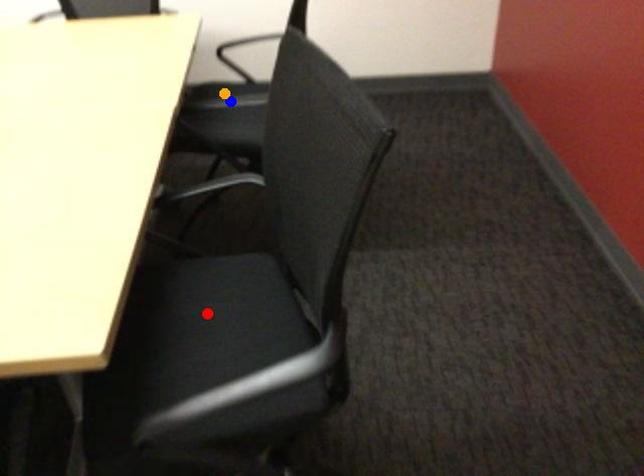
Order these from farthest to nearest:
1. orange point
2. red point
3. blue point

orange point, blue point, red point